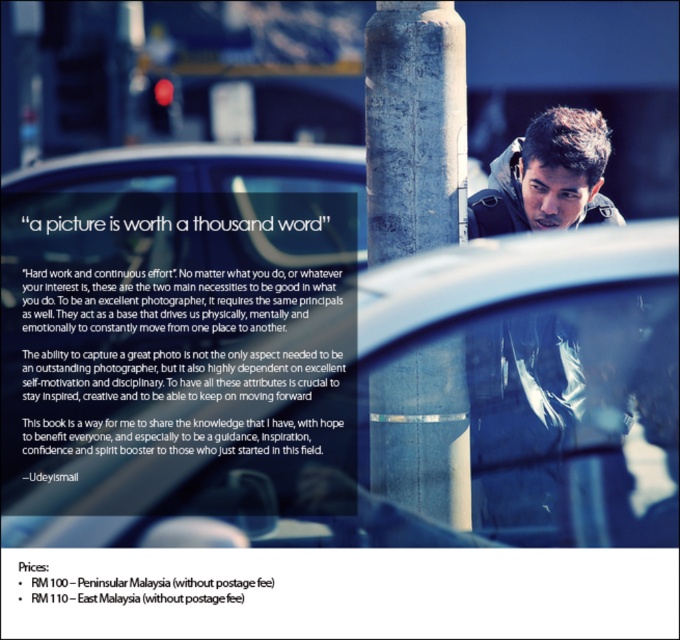
Question: Can you confirm if dark gray jacket at center is smaller than matte black jacket at upper right?

Choices:
 (A) yes
 (B) no

Answer: (B)

Question: Is gray concrete pole at center positioned at the back of dark gray jacket at center?

Choices:
 (A) no
 (B) yes

Answer: (A)

Question: Which object is closer to the camera taking this photo?

Choices:
 (A) clear glass car at center
 (B) dark gray jacket at center
 (C) matte black jacket at upper right

Answer: (A)

Question: Which object is the farthest from the dark gray jacket at center?

Choices:
 (A) gray concrete pole at center
 (B) matte black jacket at upper right
 (C) clear glass car at center

Answer: (A)

Question: Which of the following is the farthest from the observer?

Choices:
 (A) (452, 65)
 (B) (549, 189)
 (C) (73, 524)
 (D) (562, 224)

Answer: (B)

Question: Does gray concrete pole at center have a larger size compared to matte black jacket at upper right?

Choices:
 (A) yes
 (B) no

Answer: (B)